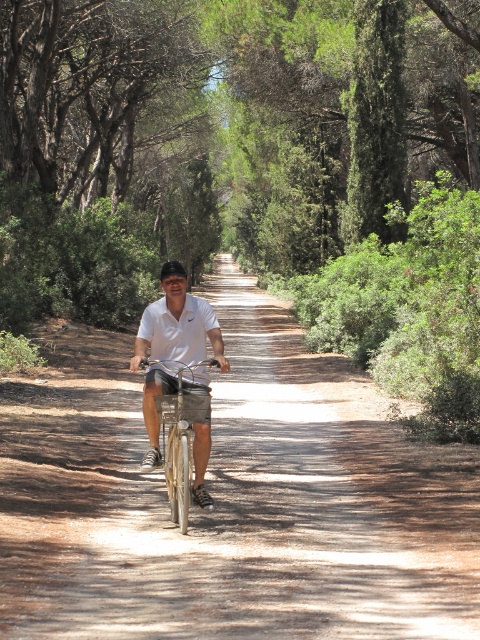
Question: Which point is closer to the camera taking this photo?

Choices:
 (A) click(x=162, y=340)
 (B) click(x=20, y=448)

Answer: (A)

Question: Does dirt path at center lie behind white matte shirt at center?

Choices:
 (A) no
 (B) yes

Answer: (A)

Question: Does dirt path at center have a greater width compared to white matte shirt at center?

Choices:
 (A) no
 (B) yes

Answer: (B)

Question: Does dirt path at center appear on the left side of white matte shirt at center?

Choices:
 (A) no
 (B) yes

Answer: (B)